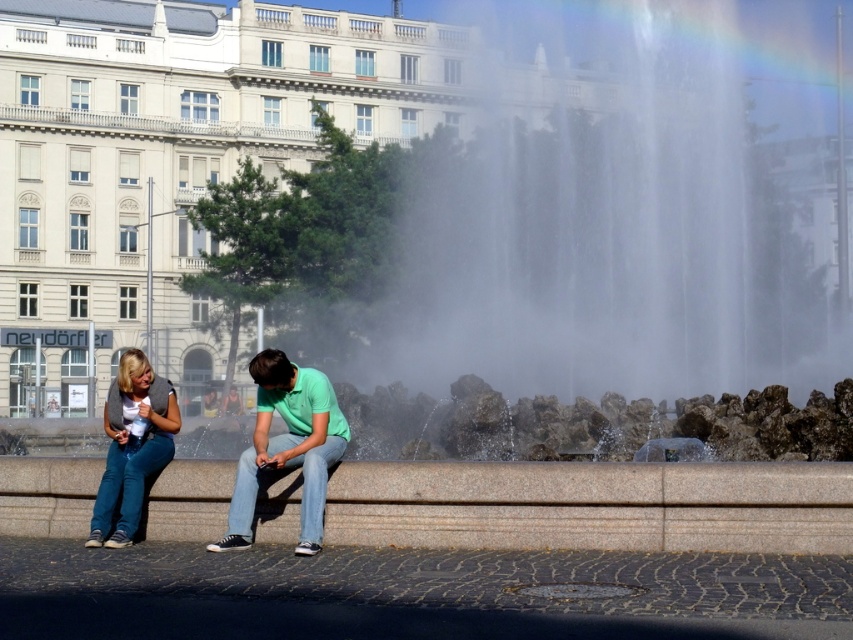
You are a photographer standing in front of the grand classical building. You notice two pairs of denim jeans at center and denim jeans at lower left in the scene. Which pair is positioned more to the right?

The denim jeans at center is positioned more to the right compared to the denim jeans at lower left.

You are a photographer planning to capture a photo of the two people wearing denim jeans at center and denim jeans at lower left. To ensure both are clearly visible, you need to adjust your camera focus. Which pair of denim jeans should you focus on first to account for their size difference?

The denim jeans at center has a smaller size compared to denim jeans at lower left, so you should focus on the denim jeans at lower left first since it is larger and might require more detailed focus to capture clearly.